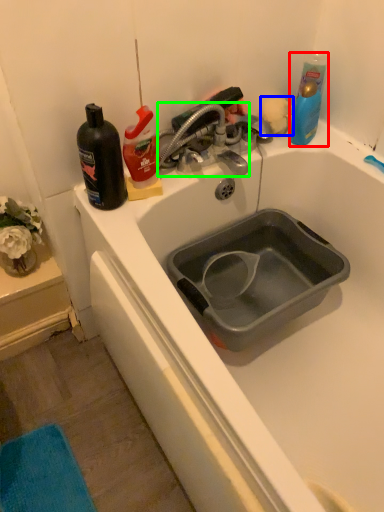
Question: Which object is the farthest from cleaning product (highlighted by a red box)? Choose among these: flower (highlighted by a blue box) or tap (highlighted by a green box).

Choices:
 (A) flower
 (B) tap

Answer: (B)